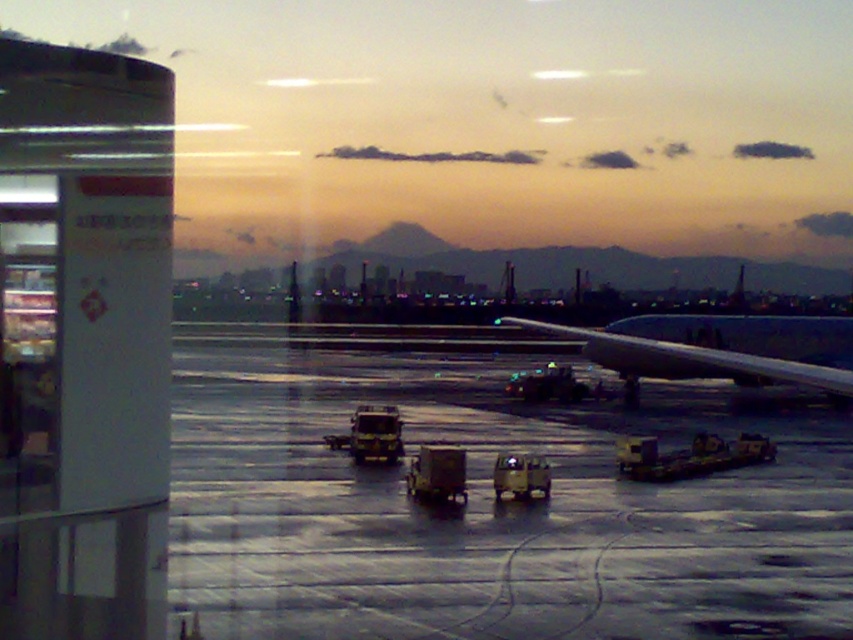
You are a maintenance worker needing to drive a 3.5 meter wide vehicle across the airport. The shiny gray tarmac at center and the metallic gray airplane at right are in your path. Can your vehicle fit through the space between the two objects?

The shiny gray tarmac at center has a width larger than the metallic gray airplane at right. Since your vehicle is 3.5 meters wide, you need to check the actual width of the tarmac. However, since the tarmac is wider than the airplane, it might accommodate your vehicle. But without exact measurements, it is uncertain. Please verify with airport staff for accurate dimensions.

You are a maintenance worker needing to reach the metallic gray airplane at right. There is a puddle on the shiny gray tarmac at center. Can you walk directly from your current position to the airplane without stepping on the puddle?

The shiny gray tarmac at center is larger in size than metallic gray airplane at right, so the puddle might be positioned away from the airplane. However, since the tarmac is larger, there might be space to walk around the puddle. But without knowing the exact location of the puddle relative to the airplane, it is uncertain if you can avoid it entirely.

You are standing inside the airport terminal and want to know how far the point at coordinates (555, 545) is from you. Can you determine the distance?

The point at coordinates (555, 545) is 12.49 meters away from the viewer.